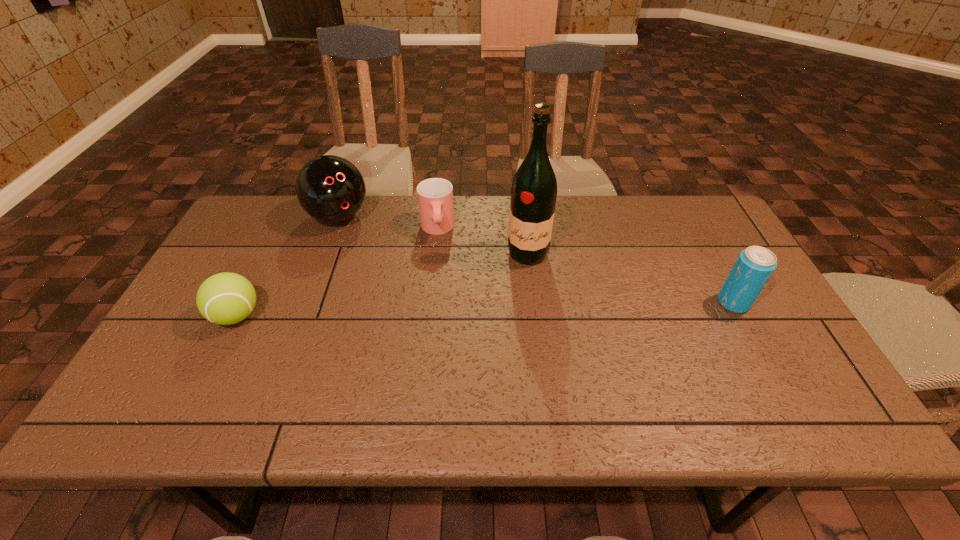
You are a GUI agent. You are given a task and a screenshot of the screen. Output one action in this format:
    pyautogui.click(x=<x>, y=<y>)
    Task: Click on the vacant space that satisfies the following two spatial constraints: 1. on the back side of the tennis ball; 2. on the left side of the tallest object
    
    Given the screenshot: What is the action you would take?
    pyautogui.click(x=268, y=254)